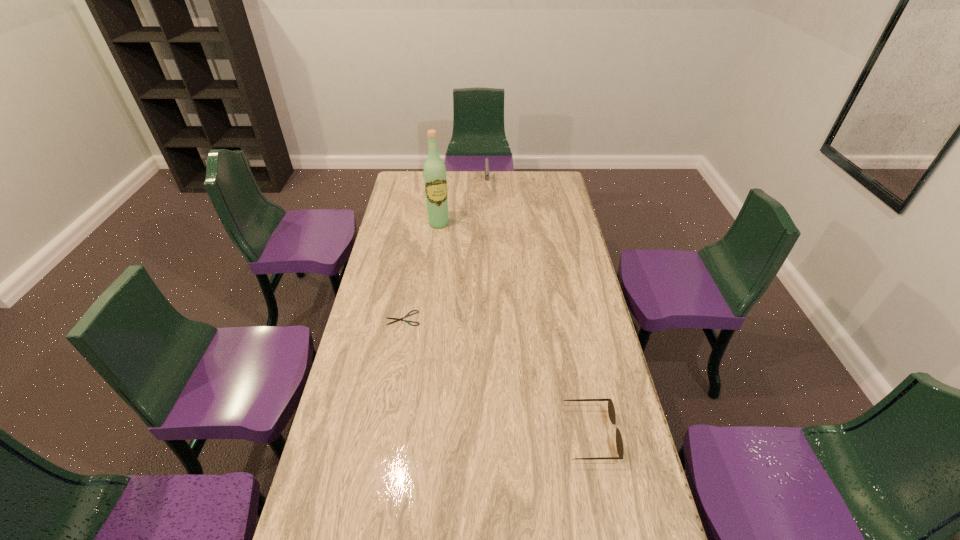
Find the location of a particular element. This screenshot has width=960, height=540. free region located on the front-facing side of the wine bottle is located at coordinates [446, 242].

Where is `free space located on the front-facing side of the wine bottle`? free space located on the front-facing side of the wine bottle is located at coordinates (459, 274).

The height and width of the screenshot is (540, 960). What are the coordinates of `blank area located 0.230m at the barrel of the third shortest object` in the screenshot? It's located at (488, 220).

In order to click on free spot located at the barrel of the third shortest object in this screenshot , I will do `click(489, 241)`.

Locate an element on the screen. This screenshot has width=960, height=540. free location located at the barrel of the third shortest object is located at coordinates (488, 212).

I want to click on object situated at the far edge, so click(486, 160).

I want to click on object at the left edge, so click(x=396, y=319).

Find the location of a particular element. Image resolution: width=960 pixels, height=540 pixels. object that is at the right edge is located at coordinates (611, 410).

Find the location of `vacant space at the far edge`. vacant space at the far edge is located at coordinates (507, 181).

I want to click on vacant space at the near edge, so click(400, 511).